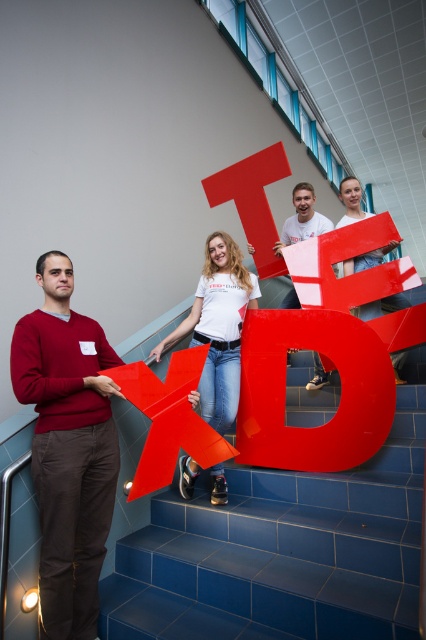
Between matte red sweater at left and matte plastic letter t at center, which one has less height?

matte plastic letter t at center

Where is `matte red sweater at left`? The image size is (426, 640). matte red sweater at left is located at coordinates (68, 448).

Which is in front, point (42, 273) or point (282, 262)?

Point (42, 273) is in front.

At what (x,y) coordinates should I click in order to perform the action: click on matte red sweater at left. Please return your answer as a coordinate pair (x, y). The image size is (426, 640). Looking at the image, I should click on (68, 448).

Does glossy plastic letter d at center have a larger size compared to white matte t-shirt at center?

No.

Is point (368, 384) closer to viewer compared to point (210, 236)?

Yes, point (368, 384) is in front of point (210, 236).

Which is in front, point (383, 346) or point (238, 252)?

Point (383, 346) is in front.

Find the location of a particular element. The image size is (426, 640). glossy plastic letter d at center is located at coordinates (284, 390).

Is white matte t-shirt at center to the right of glossy plastic man at upper center from the viewer's perspective?

Incorrect, white matte t-shirt at center is not on the right side of glossy plastic man at upper center.

Can you confirm if white matte t-shirt at center is bigger than glossy plastic man at upper center?

Yes, white matte t-shirt at center is bigger than glossy plastic man at upper center.

Which is in front, point (212, 323) or point (301, 186)?

Point (212, 323) is in front.

I want to click on white matte t-shirt at center, so click(x=218, y=326).